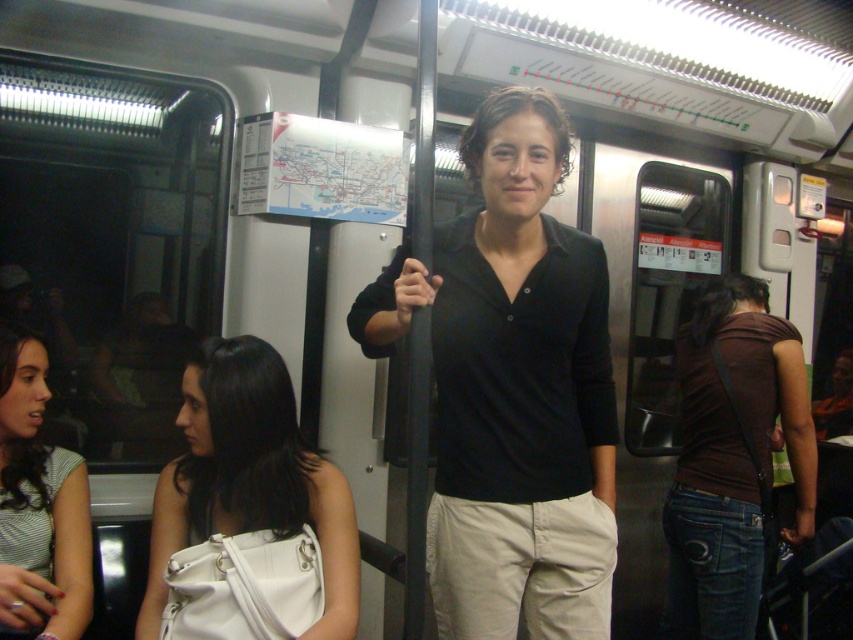
Question: Does black matte shirt at center appear under white matte bag at center left?

Choices:
 (A) no
 (B) yes

Answer: (A)

Question: Is white matte bag at center left to the left of brown matte shirt at center from the viewer's perspective?

Choices:
 (A) no
 (B) yes

Answer: (B)

Question: Can you confirm if black matte shirt at center is smaller than white matte bag at center left?

Choices:
 (A) yes
 (B) no

Answer: (B)

Question: Which of the following is the closest to the observer?

Choices:
 (A) (44, 355)
 (B) (316, 566)
 (C) (677, 627)

Answer: (B)

Question: Which point is closer to the camera?

Choices:
 (A) brown matte shirt at center
 (B) white matte bag at center left
 (C) striped fabric shirt at lower left
 (D) black matte shirt at center

Answer: (D)

Question: Which of the following is the farthest from the observer?

Choices:
 (A) (355, 625)
 (B) (489, 323)
 (C) (782, 401)
 (D) (25, 483)

Answer: (C)